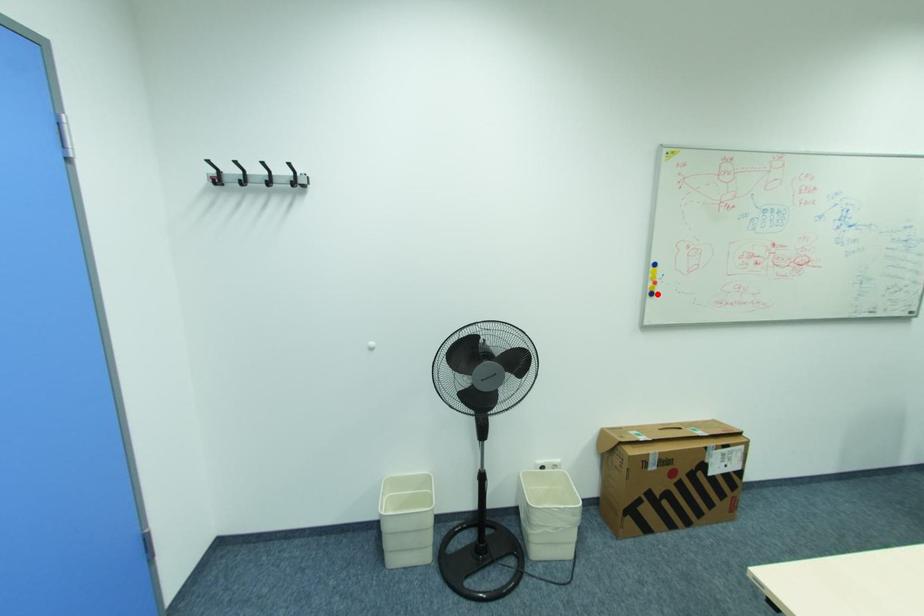
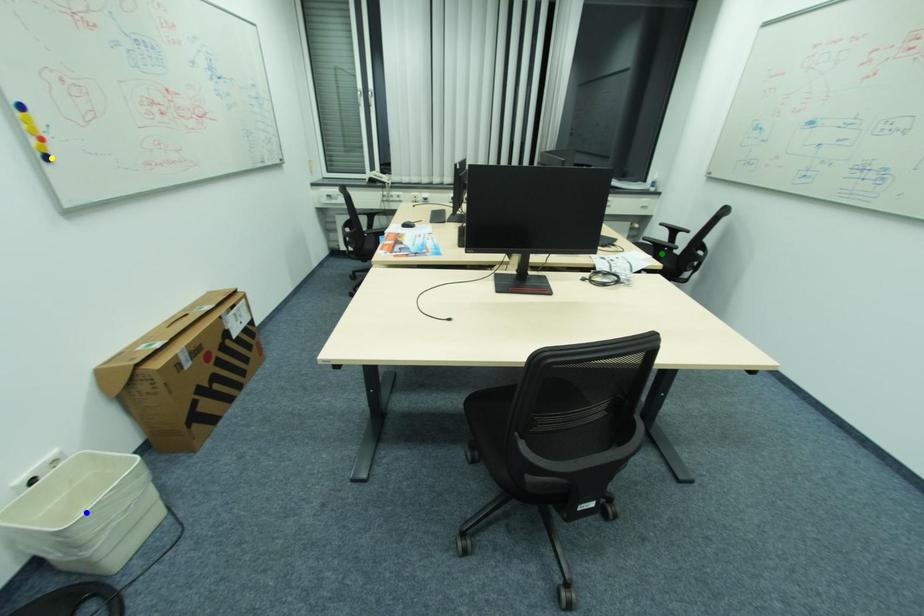
Question: I am providing you with two images of the same scene from different viewpoints. A red point is marked on the first image. You are given multiple points on the second image. Can you choose the point in image 2 that corresponds to the point in image 1?

Choices:
 (A) blue point
 (B) green point
 (C) yellow point

Answer: (C)